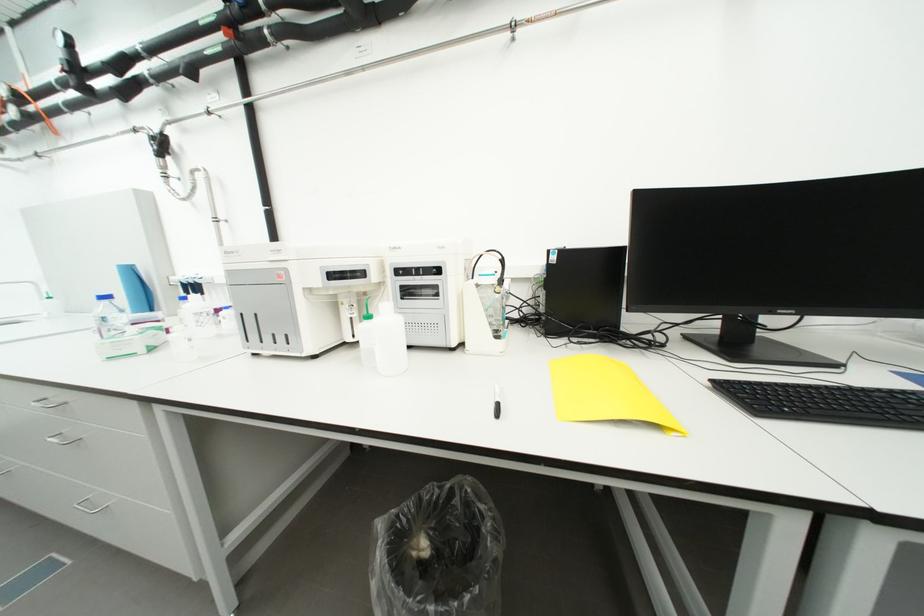
In order to click on black trash can in this screenshot , I will do `click(438, 553)`.